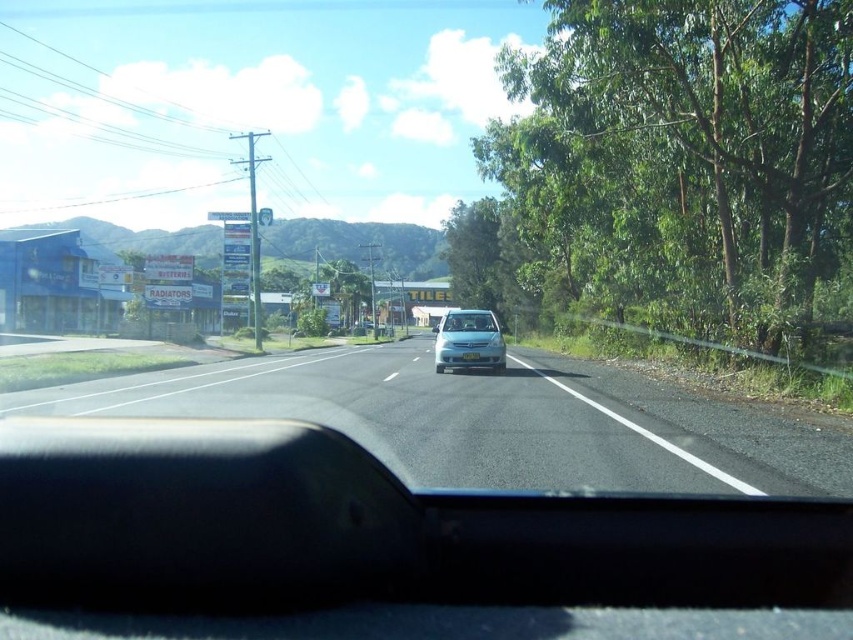
You are driving a car with a width of 1.8 meters. You need to navigate through the clear glass windshield at center to stay on the asphalt road at center. Is your car wide enough to fit through the windshield without touching it?

The asphalt road at center is wider than the clear glass windshield at center. Since the car is 1.8 meters wide, it can safely pass through the windshield as long as it stays centered, as the road provides sufficient width.

In the scene shown: You are driving a car and see two points on the road ahead. The first point is at coordinates point [798,22] and the second is at point [608,422]. Which point is closer to your current position?

Point [608,422] is closer to your current position because it is ahead of point [798,22], which is further back.